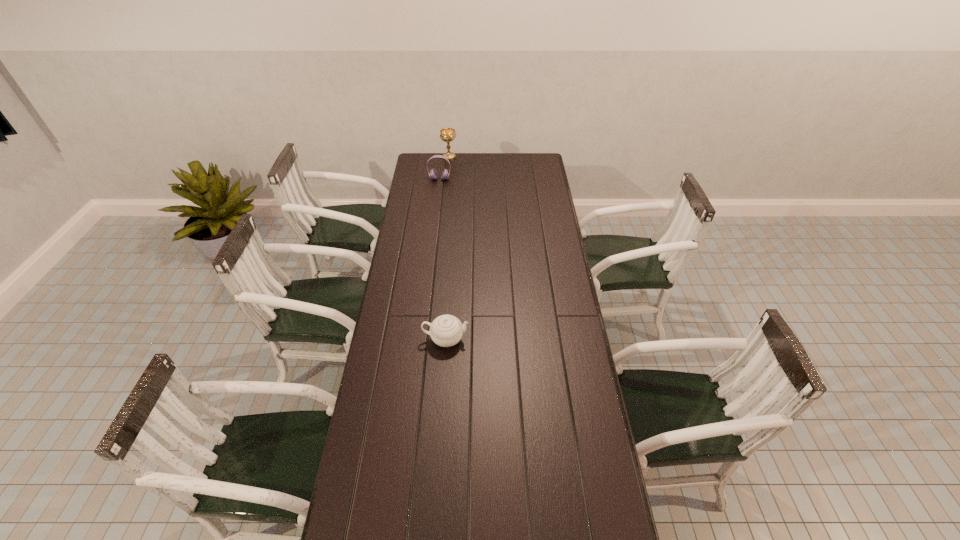
Locate an element on the screen. Image resolution: width=960 pixels, height=540 pixels. chalice is located at coordinates (447, 135).

This screenshot has width=960, height=540. What are the coordinates of `headset` in the screenshot? It's located at click(433, 174).

Locate an element on the screen. This screenshot has width=960, height=540. the shortest object is located at coordinates (446, 330).

Find the location of a particular element. the nearest object is located at coordinates (446, 330).

Where is `vacant space situated on the right of the chalice`? The width and height of the screenshot is (960, 540). vacant space situated on the right of the chalice is located at coordinates (483, 157).

Identify the location of vacant space located 0.270m on the headband and ear cups of the second farthest object. (436, 210).

This screenshot has width=960, height=540. What are the coordinates of `vacant space located 0.320m on the spout of the shortest object` in the screenshot? It's located at (549, 339).

Find the location of a particular element. object at the far edge is located at coordinates (447, 135).

Locate an element on the screen. Image resolution: width=960 pixels, height=540 pixels. chalice situated at the left edge is located at coordinates (447, 135).

Locate an element on the screen. headset situated at the left edge is located at coordinates (433, 174).